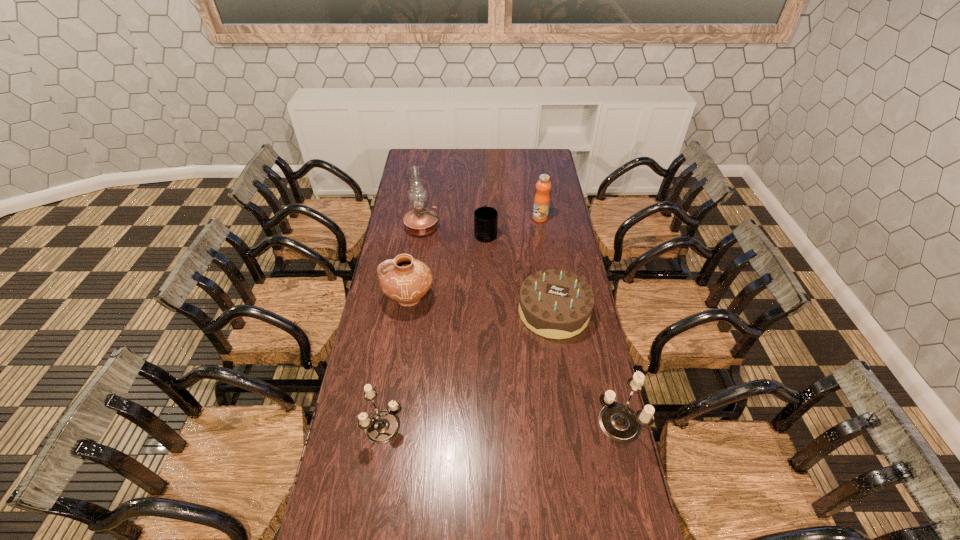
Where is `the left candle holder`? This screenshot has height=540, width=960. the left candle holder is located at coordinates (382, 426).

You are a GUI agent. You are given a task and a screenshot of the screen. Output one action in this format:
    pyautogui.click(x=<x>, y=<y>)
    Task: Click on the right candle holder
    This screenshot has width=960, height=540.
    Given the screenshot: What is the action you would take?
    pyautogui.click(x=618, y=422)

What are the coordinates of `the tallest object` in the screenshot? It's located at (420, 221).

Identify the location of fruit juice. The height and width of the screenshot is (540, 960). (x=542, y=198).

The height and width of the screenshot is (540, 960). What are the coordinates of `pottery` in the screenshot? It's located at (406, 280).

Locate an element on the screen. the fourth object from right to left is located at coordinates (485, 218).

Where is `birthday cake`? The height and width of the screenshot is (540, 960). birthday cake is located at coordinates (553, 303).

The image size is (960, 540). I want to click on vacant space positioned 0.120m on the right of the shorter candle holder, so click(443, 426).

Locate an element on the screen. The image size is (960, 540). vacant region located 0.140m on the back of the right candle holder is located at coordinates (603, 366).

In order to click on free space located on the back of the oil lamp in this screenshot , I will do `click(425, 205)`.